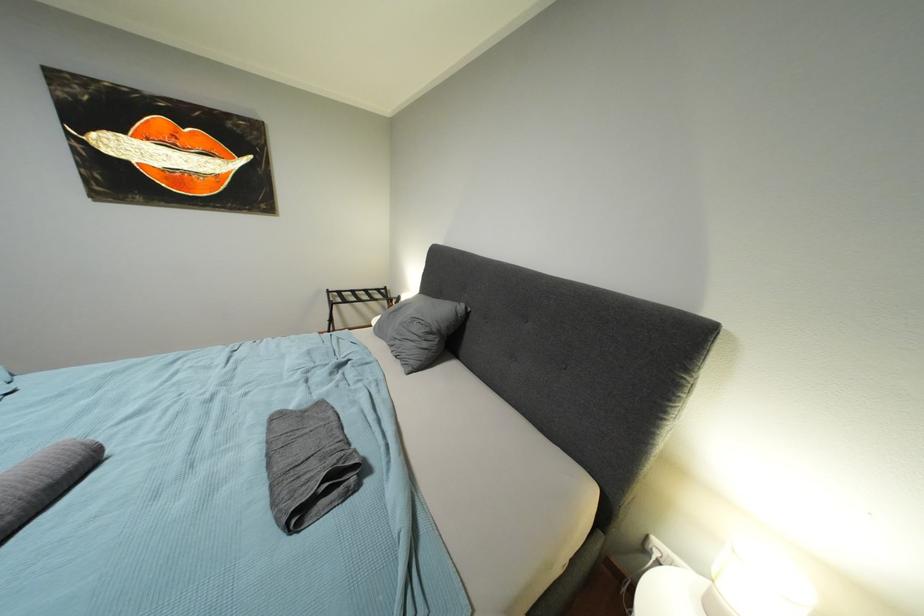
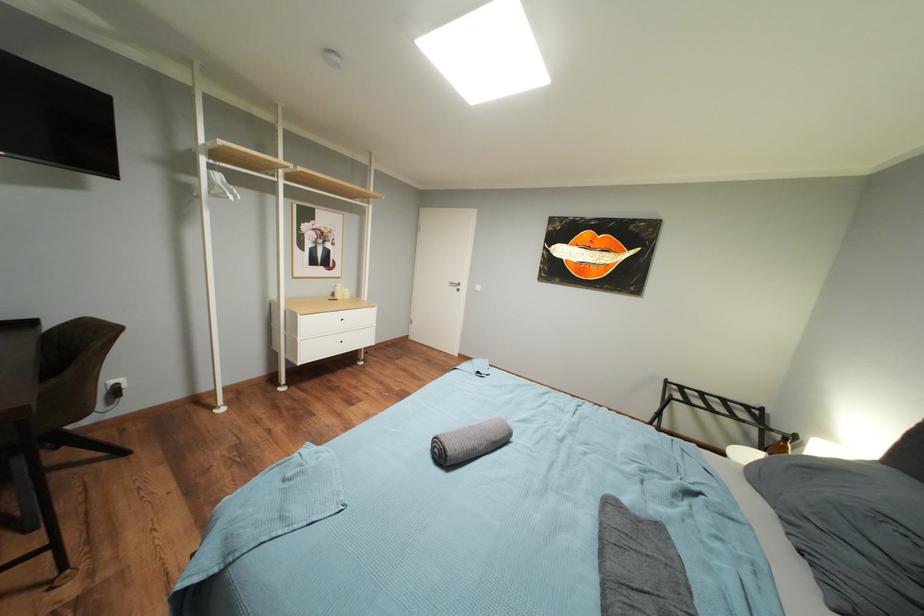
Question: The camera is either moving clockwise (left) or counter-clockwise (right) around the object. The first image is from the beginning of the video and the second image is from the end. Is the camera moving left or right when shooting the video?

Choices:
 (A) Left
 (B) Right

Answer: (B)